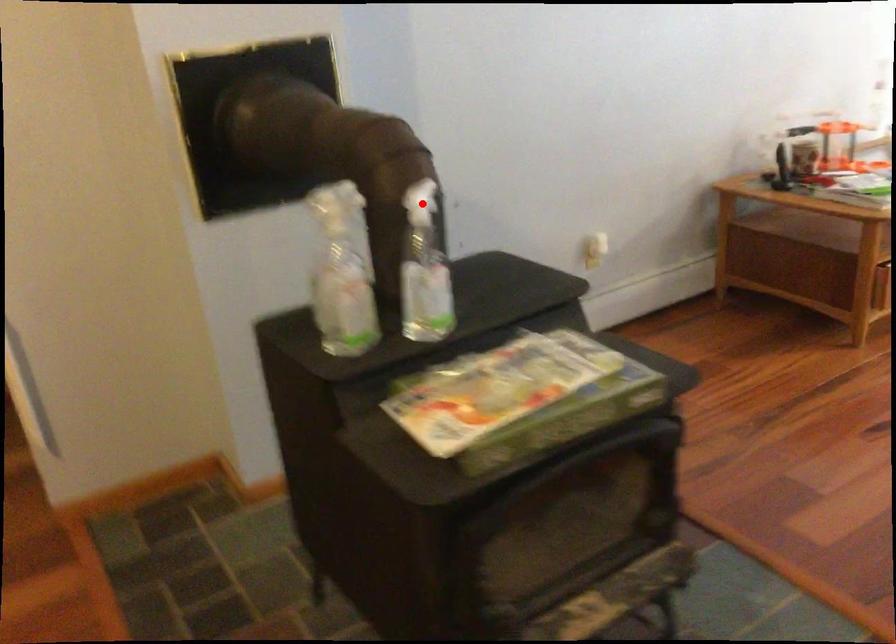
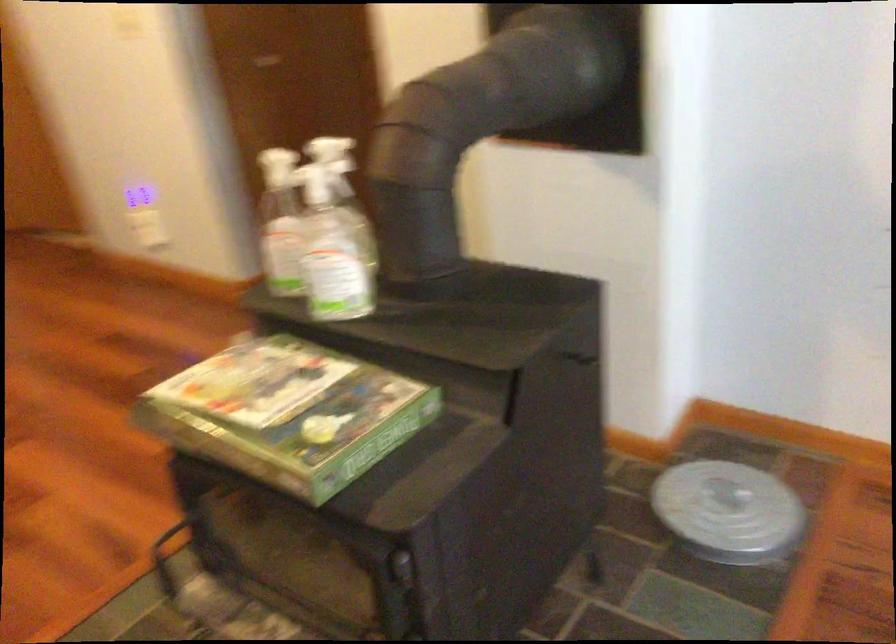
Where in the second image is the point corresponding to the highlighted location from the first image?

(314, 184)